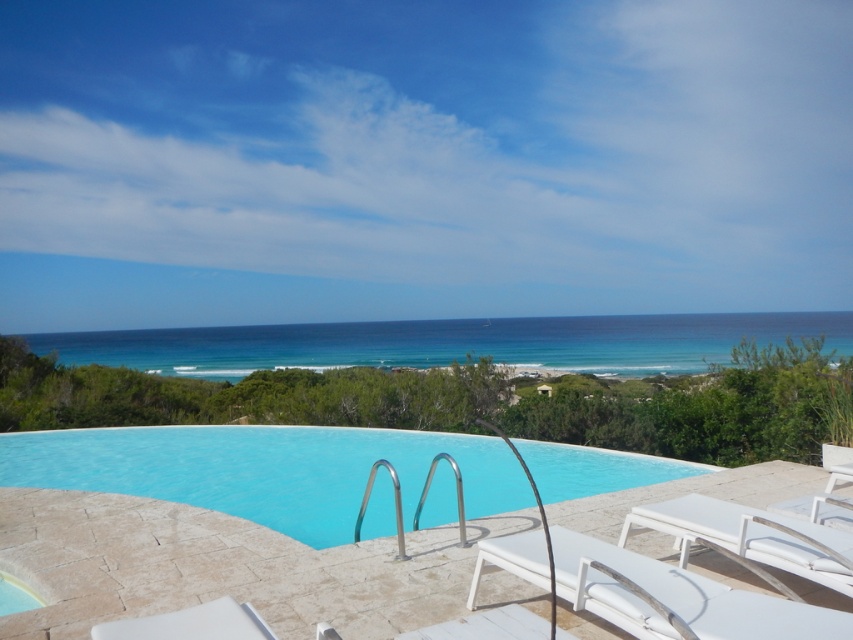
Question: Which object appears closest to the camera in this image?

Choices:
 (A) white matte beach chair at lower right
 (B) smooth glass pool at center

Answer: (A)

Question: Does white fabric beach chair at lower right lie in front of white matte beach chair at lower right?

Choices:
 (A) no
 (B) yes

Answer: (B)

Question: Which point is closer to the camera?

Choices:
 (A) white fabric beach chair at lower right
 (B) white matte beach chair at lower right

Answer: (A)

Question: Observing the image, what is the correct spatial positioning of smooth glass pool at center in reference to white matte beach chair at lower right?

Choices:
 (A) left
 (B) right

Answer: (A)

Question: Is smooth glass pool at center above white fabric beach chair at lower right?

Choices:
 (A) yes
 (B) no

Answer: (B)

Question: Which point is farther from the camera taking this photo?

Choices:
 (A) (798, 550)
 (B) (206, 500)

Answer: (B)